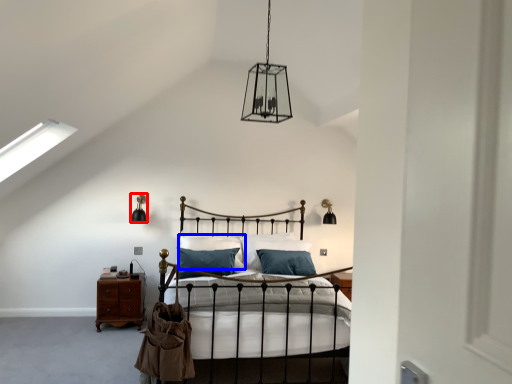
Question: Which of the following is the farthest to the observer, light fixture (highlighted by a red box) or pillow (highlighted by a blue box)?

Choices:
 (A) light fixture
 (B) pillow

Answer: (A)